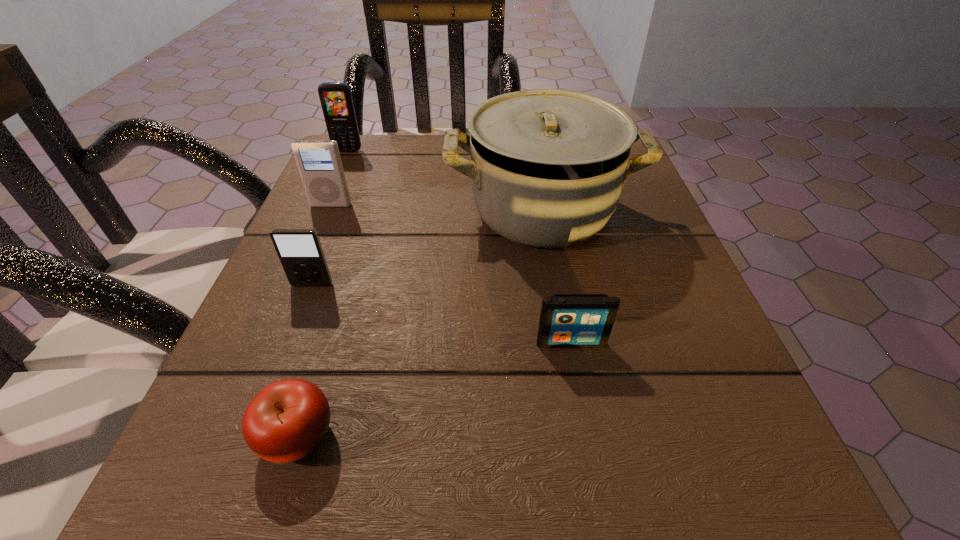
Where is `the tallest object`? the tallest object is located at coordinates (547, 166).

I want to click on cellular telephone, so click(x=336, y=100).

Image resolution: width=960 pixels, height=540 pixels. Find the location of `the farthest iPod`. the farthest iPod is located at coordinates (319, 162).

The width and height of the screenshot is (960, 540). I want to click on the tallest iPod, so 319,162.

At what (x,y) coordinates should I click in order to perform the action: click on the second nearest iPod. Please return your answer as a coordinate pair (x, y). The image size is (960, 540). Looking at the image, I should click on [x=300, y=252].

The width and height of the screenshot is (960, 540). I want to click on the fourth farthest object, so click(300, 252).

You are a GUI agent. You are given a task and a screenshot of the screen. Output one action in this format:
    pyautogui.click(x=<x>, y=<y>)
    Task: Click on the rightmost iPod
    The height and width of the screenshot is (540, 960).
    Given the screenshot: What is the action you would take?
    pyautogui.click(x=566, y=320)

The width and height of the screenshot is (960, 540). Find the location of `the second nearest object`. the second nearest object is located at coordinates (566, 320).

Find the location of `apple`. apple is located at coordinates (288, 419).

The height and width of the screenshot is (540, 960). I want to click on vacant area located on the front of the saucepan, so (566, 352).